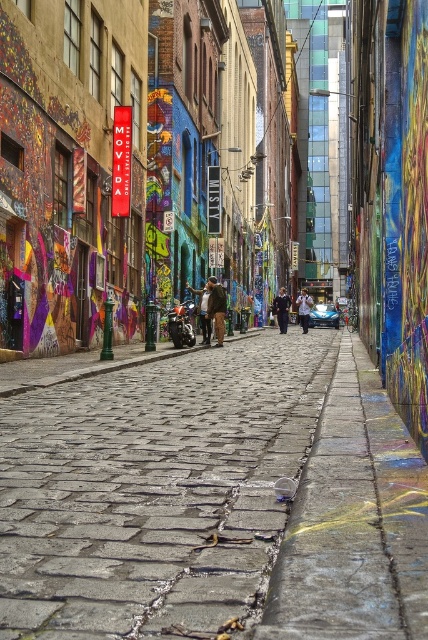
Is dark blue jacket at center smaller than dark blue jeans at center?

Correct, dark blue jacket at center occupies less space than dark blue jeans at center.

Is dark blue jacket at center positioned in front of dark blue jeans at center?

Yes, dark blue jacket at center is in front of dark blue jeans at center.

Describe the element at coordinates (282, 308) in the screenshot. I see `dark blue jacket at center` at that location.

The image size is (428, 640). What are the coordinates of `dark blue jacket at center` in the screenshot? It's located at (282, 308).

Between brown leather jacket at center and dark blue jacket at center, which one appears on the left side from the viewer's perspective?

From the viewer's perspective, brown leather jacket at center appears more on the left side.

Does brown leather jacket at center have a greater width compared to dark blue jacket at center?

In fact, brown leather jacket at center might be narrower than dark blue jacket at center.

This screenshot has width=428, height=640. Find the location of `brown leather jacket at center`. brown leather jacket at center is located at coordinates (216, 308).

Is shiny chrome motorcycle at center shorter than brown leather jacket at center?

No, shiny chrome motorcycle at center is not shorter than brown leather jacket at center.

How distant is shiny chrome motorcycle at center from brown leather jacket at center?

shiny chrome motorcycle at center and brown leather jacket at center are 6.58 feet apart from each other.

Is point (190, 330) behind point (214, 292)?

No, it is in front of (214, 292).

You are a GUI agent. You are given a task and a screenshot of the screen. Output one action in this format:
    pyautogui.click(x=<x>, y=<y>)
    Task: Click on the shiny chrome motorcycle at center
    This screenshot has height=640, width=428.
    Given the screenshot: What is the action you would take?
    pyautogui.click(x=181, y=324)